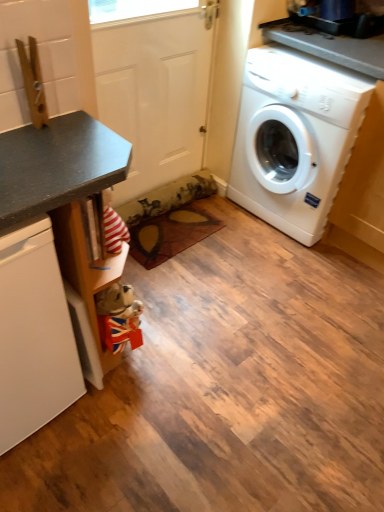
Where is `free spot to the right of matte black counter at left`? free spot to the right of matte black counter at left is located at coordinates (192, 368).